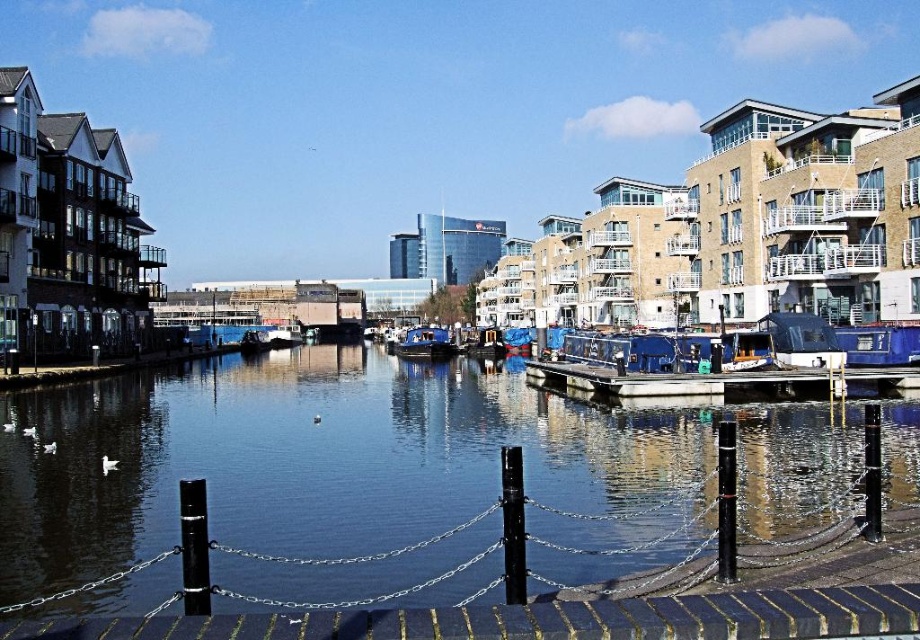
Consider the image. Is dark blue water at center to the left of blue painted wood dock at center from the viewer's perspective?

Indeed, dark blue water at center is positioned on the left side of blue painted wood dock at center.

Is point (461, 531) farther from viewer compared to point (650, 387)?

No, it is not.

Identify the location of dark blue water at center. (378, 477).

Does dark blue water at center appear over blue matte boat at center?

Actually, dark blue water at center is below blue matte boat at center.

Which is behind, point (72, 600) or point (427, 346)?

The point (427, 346) is behind.

This screenshot has height=640, width=920. In order to click on dark blue water at center in this screenshot , I will do click(378, 477).

Who is positioned more to the right, blue painted wood dock at center or blue tarpaulin boat at center?

From the viewer's perspective, blue painted wood dock at center appears more on the right side.

Locate an element on the screen. The height and width of the screenshot is (640, 920). blue painted wood dock at center is located at coordinates pyautogui.click(x=723, y=381).